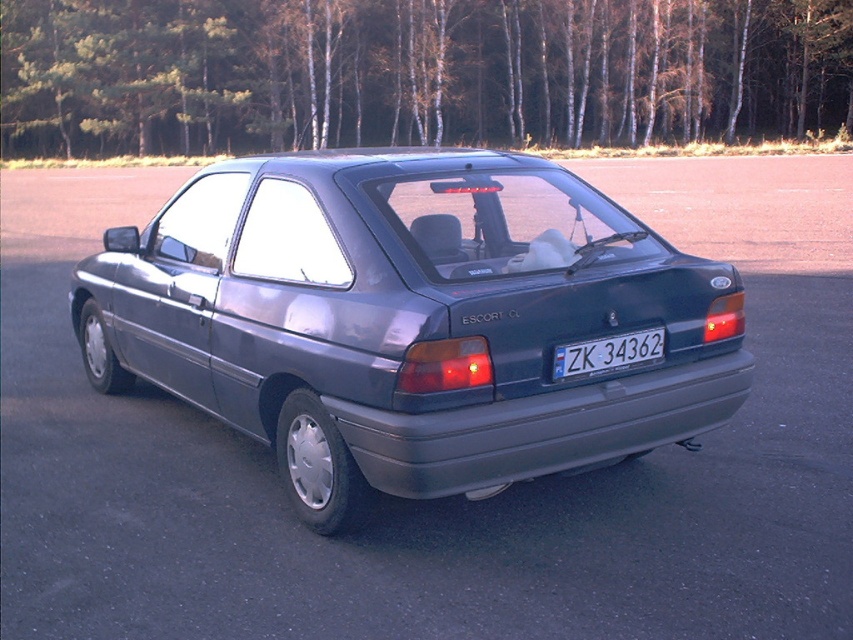
Question: Which point is farther to the camera?

Choices:
 (A) white plastic license plate at center
 (B) satin metallic car at center

Answer: (A)

Question: Is satin metallic car at center wider than white plastic license plate at center?

Choices:
 (A) yes
 (B) no

Answer: (A)

Question: Is satin metallic car at center positioned at the back of white plastic license plate at center?

Choices:
 (A) no
 (B) yes

Answer: (A)

Question: Which of the following is the closest to the observer?

Choices:
 (A) white plastic license plate at center
 (B) satin metallic car at center

Answer: (B)

Question: Among these objects, which one is farthest from the camera?

Choices:
 (A) satin metallic car at center
 (B) white plastic license plate at center

Answer: (B)

Question: Where is satin metallic car at center located in relation to white plastic license plate at center in the image?

Choices:
 (A) left
 (B) right

Answer: (A)